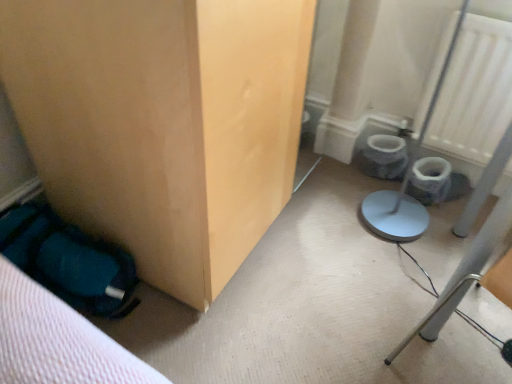
Question: Is matte wood cabinet at lower left taller or shorter than white textured radiator at upper right?

Choices:
 (A) short
 (B) tall

Answer: (B)

Question: Visually, is matte wood cabinet at lower left positioned to the left or to the right of white textured radiator at upper right?

Choices:
 (A) left
 (B) right

Answer: (A)

Question: Considering the positions of point (80, 215) and point (463, 23), is point (80, 215) closer or farther from the camera than point (463, 23)?

Choices:
 (A) closer
 (B) farther

Answer: (A)

Question: Is white textured radiator at upper right bigger or smaller than matte wood cabinet at lower left?

Choices:
 (A) small
 (B) big

Answer: (A)

Question: From a real-world perspective, relative to matte wood cabinet at lower left, is white textured radiator at upper right vertically above or below?

Choices:
 (A) above
 (B) below

Answer: (B)

Question: Is white textured radiator at upper right in front of or behind matte wood cabinet at lower left in the image?

Choices:
 (A) front
 (B) behind

Answer: (B)

Question: Would you say white textured radiator at upper right is to the left or to the right of matte wood cabinet at lower left in the picture?

Choices:
 (A) right
 (B) left

Answer: (A)